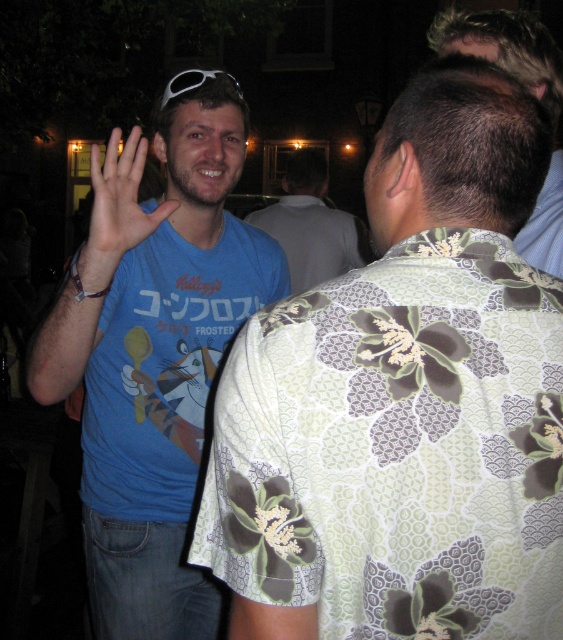
Question: Where is floral-patterned shirt at left located in relation to white plastic sunglasses at upper center in the image?

Choices:
 (A) left
 (B) right

Answer: (B)

Question: Does matte blue shirt at center have a smaller size compared to white plastic sunglasses at upper center?

Choices:
 (A) no
 (B) yes

Answer: (A)

Question: Which object is positioned farthest from the floral fabric shirt at upper right?

Choices:
 (A) floral-patterned shirt at left
 (B) blue cotton t-shirt at left
 (C) white plastic sunglasses at upper center

Answer: (B)

Question: Considering the real-world distances, which object is farthest from the floral-patterned shirt at left?

Choices:
 (A) blue cotton t-shirt at left
 (B) floral fabric shirt at upper right
 (C) matte blue shirt at center

Answer: (A)

Question: Where is floral-patterned shirt at left located in relation to blue cotton shirt at center in the image?

Choices:
 (A) right
 (B) left

Answer: (A)

Question: Considering the real-world distances, which object is farthest from the matte blue shirt at center?

Choices:
 (A) floral fabric shirt at upper right
 (B) blue cotton shirt at center
 (C) blue cotton t-shirt at left
 (D) floral-patterned shirt at left

Answer: (B)